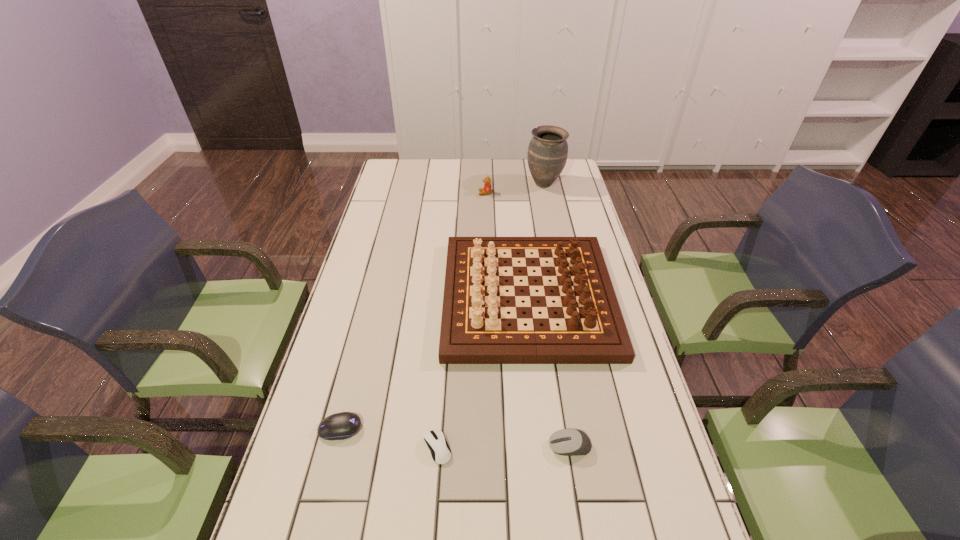
Where is `vacant area that lies between the third tallest object and the tallest object`? Image resolution: width=960 pixels, height=540 pixels. vacant area that lies between the third tallest object and the tallest object is located at coordinates (515, 188).

Locate an element on the screen. This screenshot has width=960, height=540. vacant area between the tallest object and the third tallest object is located at coordinates (515, 188).

You are a GUI agent. You are given a task and a screenshot of the screen. Output one action in this format:
    pyautogui.click(x=<x>, y=<y>)
    Task: Click on the empty space between the rightmost mouse and the second mouse from left to right
    The height and width of the screenshot is (540, 960).
    Given the screenshot: What is the action you would take?
    pyautogui.click(x=504, y=447)

The image size is (960, 540). I want to click on vacant space in between the urn and the third tallest object, so click(515, 188).

Where is `blank region between the fourth shortest object and the urn`? This screenshot has height=540, width=960. blank region between the fourth shortest object and the urn is located at coordinates (515, 188).

Find the location of a particular element. Image resolution: width=960 pixels, height=540 pixels. free spot between the rightmost mouse and the gameboard is located at coordinates (549, 372).

This screenshot has width=960, height=540. Find the location of `object identified as the third closest to the urn`. object identified as the third closest to the urn is located at coordinates (568, 442).

Identify which object is located as the third nearest to the tallest object. Please provide its 2D coordinates. Your answer should be formatted as a tuple, i.e. [(x, y)], where the tuple contains the x and y coordinates of a point satisfying the conditions above.

[(568, 442)]

Point out which mouse is positioned as the third nearest to the fourth nearest object. Please provide its 2D coordinates. Your answer should be formatted as a tuple, i.e. [(x, y)], where the tuple contains the x and y coordinates of a point satisfying the conditions above.

[(339, 426)]

Choose which mouse is the second nearest neighbor to the urn. Please provide its 2D coordinates. Your answer should be formatted as a tuple, i.e. [(x, y)], where the tuple contains the x and y coordinates of a point satisfying the conditions above.

[(440, 451)]